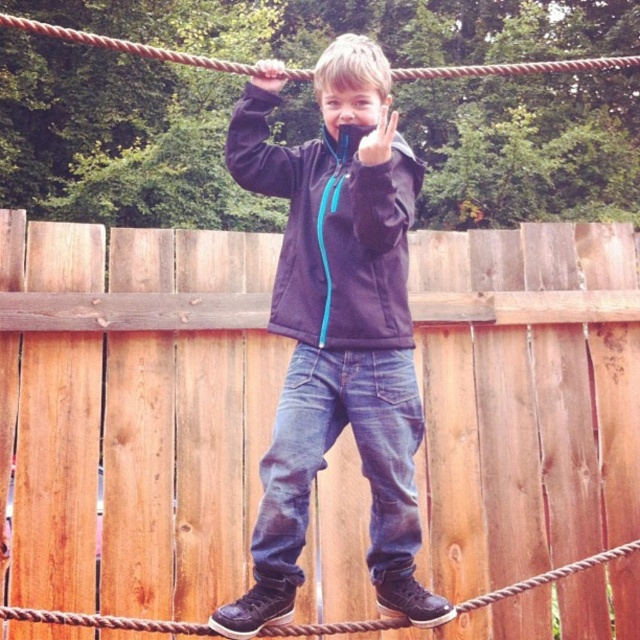
Is brown rope at center to the left of brown rope at upper center from the viewer's perspective?

In fact, brown rope at center is to the right of brown rope at upper center.

The height and width of the screenshot is (640, 640). Identify the location of brown rope at center. (104, 621).

Identify the location of brown rope at center. Image resolution: width=640 pixels, height=640 pixels. (104, 621).

Where is `brown rope at center`? This screenshot has height=640, width=640. brown rope at center is located at coordinates (104, 621).

Is brown wooden fence at center smaller than brown rope at center?

Actually, brown wooden fence at center might be larger than brown rope at center.

Does brown wooden fence at center have a greater height compared to brown rope at center?

Yes, brown wooden fence at center is taller than brown rope at center.

Between point (572, 365) and point (292, 625), which one is positioned in front?

Positioned in front is point (292, 625).

Identify the location of brown wooden fence at center. (132, 412).

Is brown wooden fence at center wider than matte blue jacket at center?

Yes, brown wooden fence at center is wider than matte blue jacket at center.

Locate an element on the screen. brown wooden fence at center is located at coordinates (132, 412).

At what (x,y) coordinates should I click in order to perform the action: click on brown wooden fence at center. Please return your answer as a coordinate pair (x, y). This screenshot has height=640, width=640. Looking at the image, I should click on (132, 412).

Identify the location of brown wooden fence at center. (132, 412).